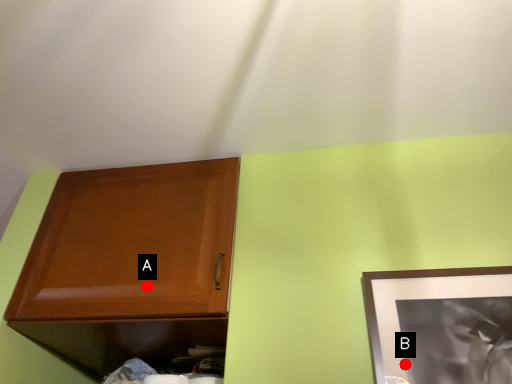
Question: Two points are circled on the image, labeled by A and B beside each circle. Among these points, which one is nearest to the camera?

Choices:
 (A) A is closer
 (B) B is closer

Answer: (B)